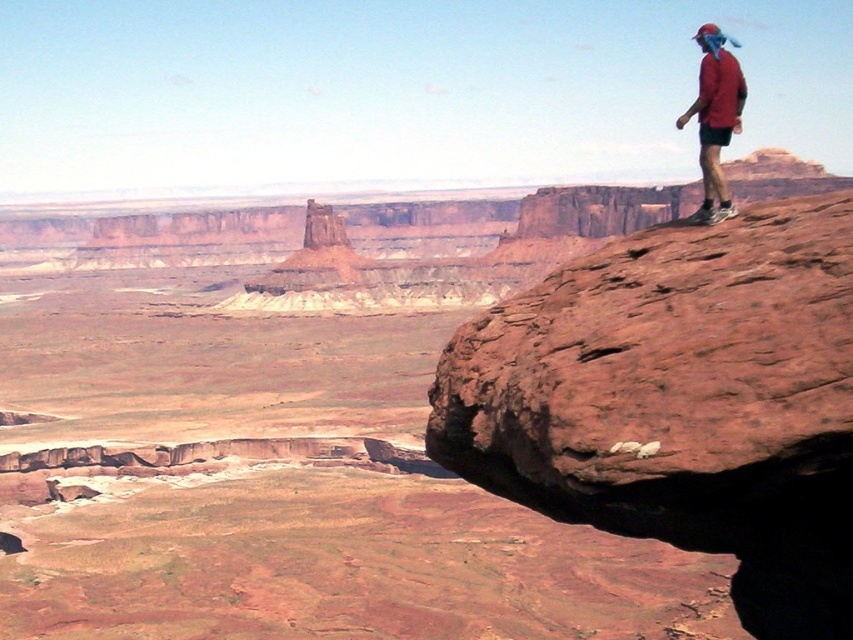
You are a hiker planning to take a photo of the rusty rock at upper right and the red matte shirt at upper right from a position where both are in frame. Given that the camera you have can focus on objects up to 100 feet away, will you be able to capture both subjects clearly in the same photo?

The rusty rock at upper right is 104.90 feet away from the red matte shirt at upper right. Since the camera can only focus up to 100 feet, the distance between them exceeds the camera range. Therefore, you cannot capture both subjects clearly in the same photo.

You are a photographer planning to capture the red matte shirt at upper right and the rusty rock at upper right in the same frame. Based on their sizes, which object should you focus on first to ensure both are in focus?

The rusty rock at upper right is smaller than the red matte shirt at upper right, so you should focus on the red matte shirt at upper right first to ensure both are in focus.

You are a hiker looking at the canyon scene. You see the rusty rock at upper right and the red matte shirt at upper right. Which object is positioned lower in the image?

The rusty rock at upper right is positioned lower than the red matte shirt at upper right in the image.